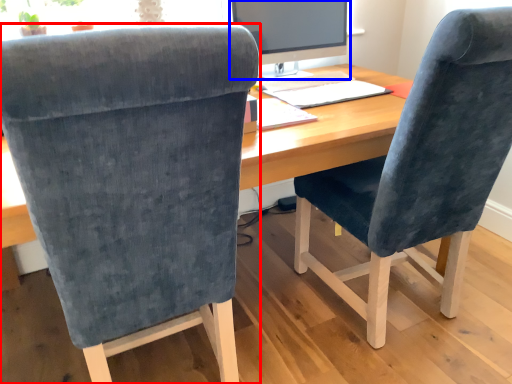
Question: Which object is further to the camera taking this photo, chair (highlighted by a red box) or computer monitor (highlighted by a blue box)?

Choices:
 (A) chair
 (B) computer monitor

Answer: (B)